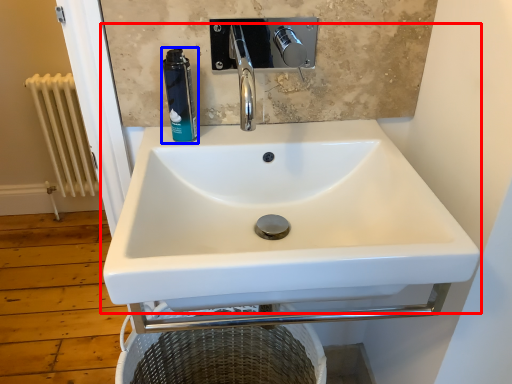
Question: Which object is further to the camera taking this photo, sink (highlighted by a red box) or mouthwash (highlighted by a blue box)?

Choices:
 (A) sink
 (B) mouthwash

Answer: (B)